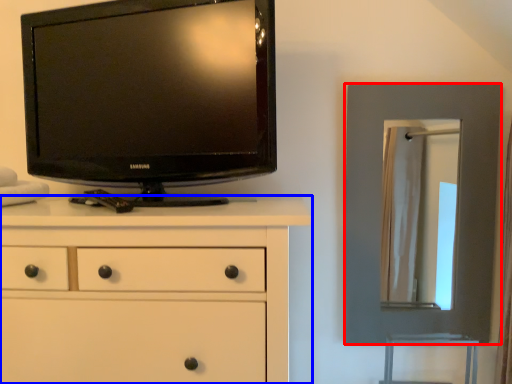
Question: Which object is further to the camera taking this photo, picture frame (highlighted by a red box) or chest of drawers (highlighted by a blue box)?

Choices:
 (A) picture frame
 (B) chest of drawers

Answer: (A)